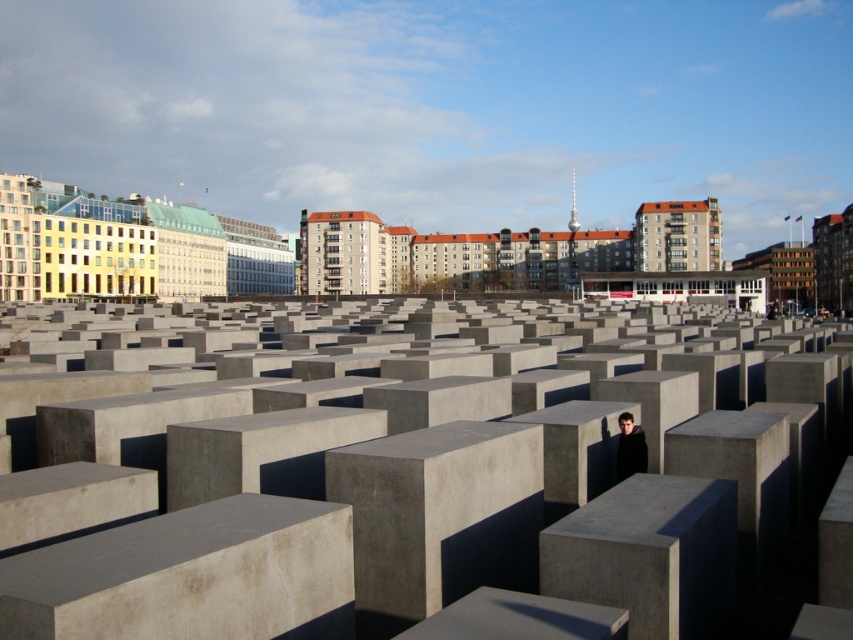
Which of these two, smooth gray concrete blocks at center or black matte jacket at center, stands shorter?

Standing shorter between the two is black matte jacket at center.

Is smooth gray concrete blocks at center further to the viewer compared to black matte jacket at center?

No, smooth gray concrete blocks at center is in front of black matte jacket at center.

Does point (421, 609) lie in front of point (624, 417)?

Yes, it is.

Locate an element on the screen. Image resolution: width=853 pixels, height=640 pixels. smooth gray concrete blocks at center is located at coordinates point(410,497).